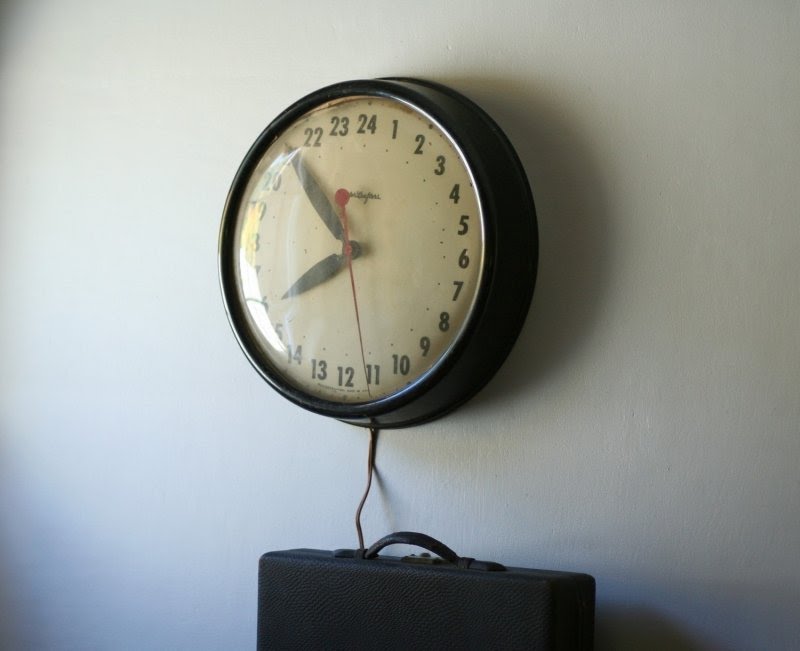
Locate an element on the screen. wall clock is located at coordinates (x=372, y=298).